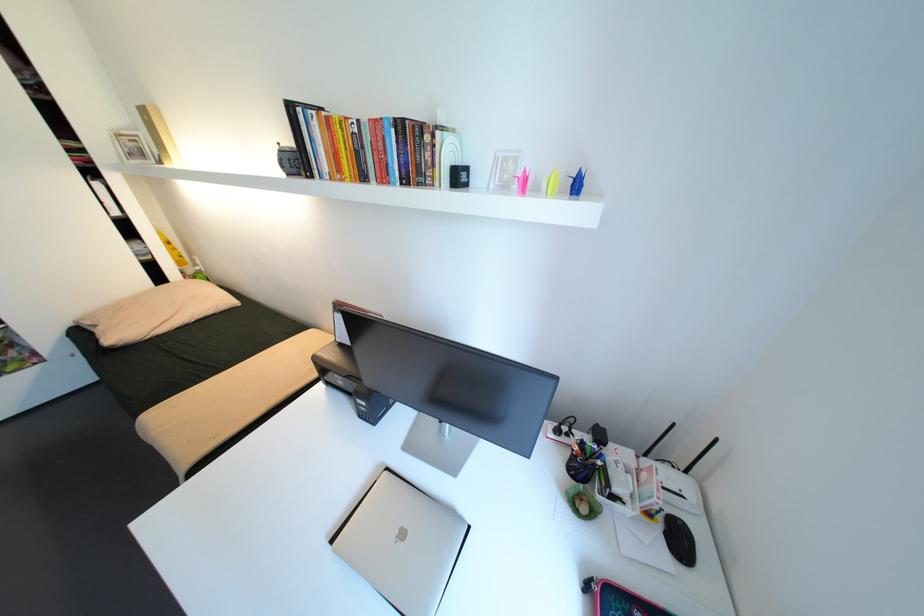
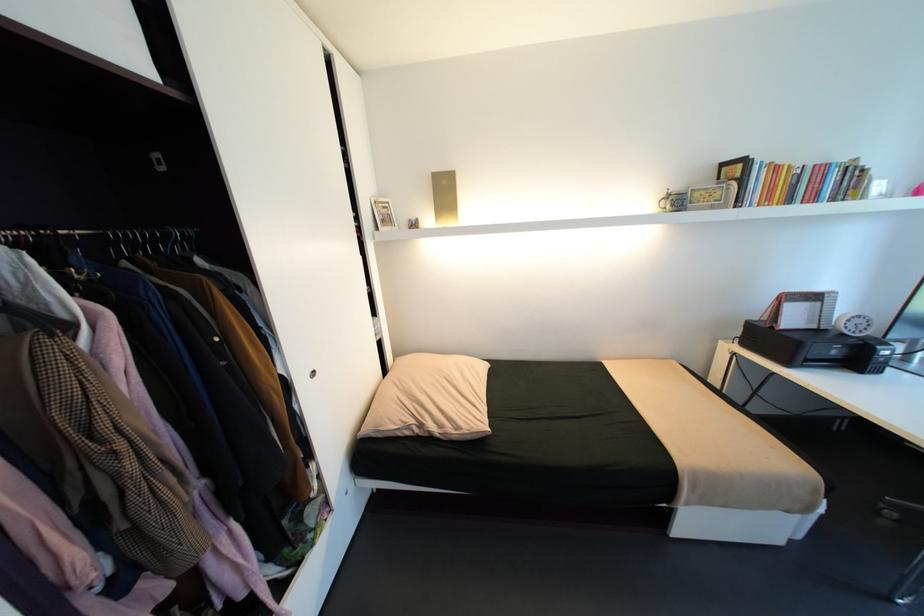
The point at [138,140] is marked in the first image. Where is the corresponding point in the second image?

(392, 208)